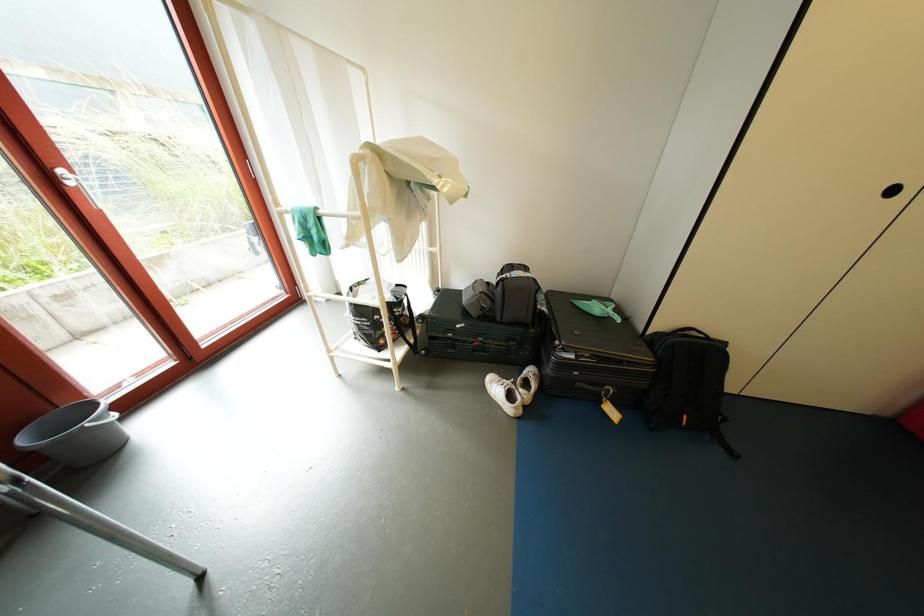
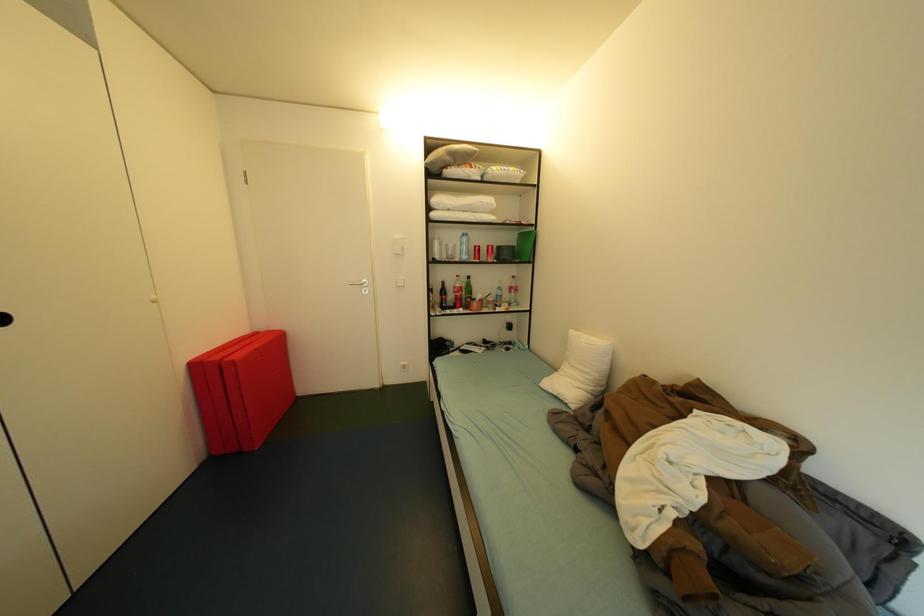
First-person continuous shooting, in which direction is the camera rotating?

The rotation direction of the camera is right-down.